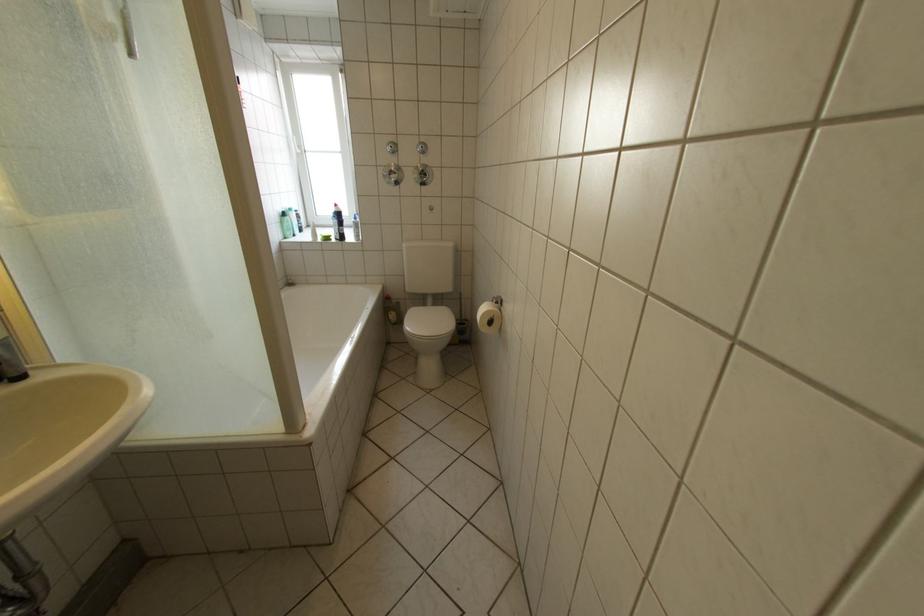
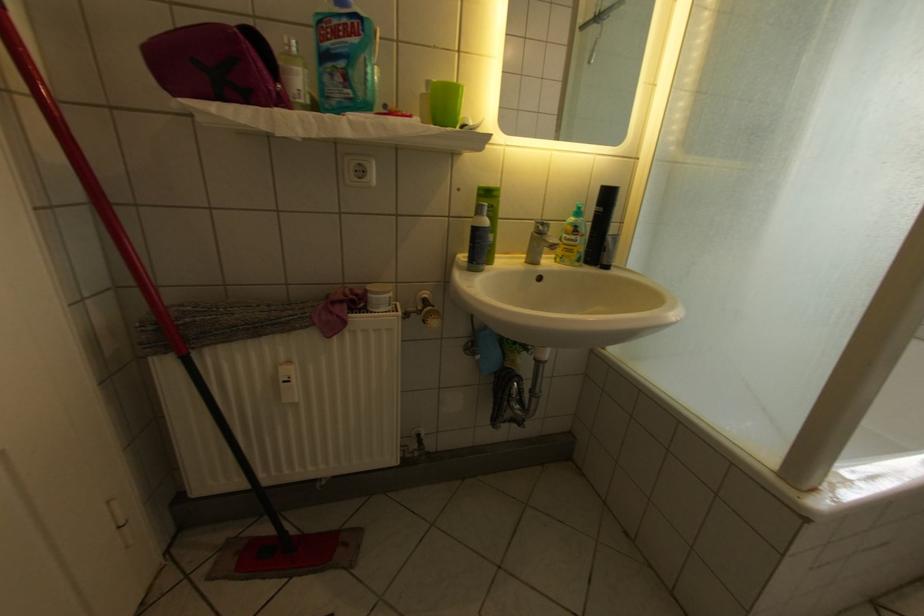
Question: The images are taken continuously from a first-person perspective. In which direction is your viewpoint rotating?

Choices:
 (A) Left
 (B) Right
 (C) Up
 (D) Down

Answer: (A)